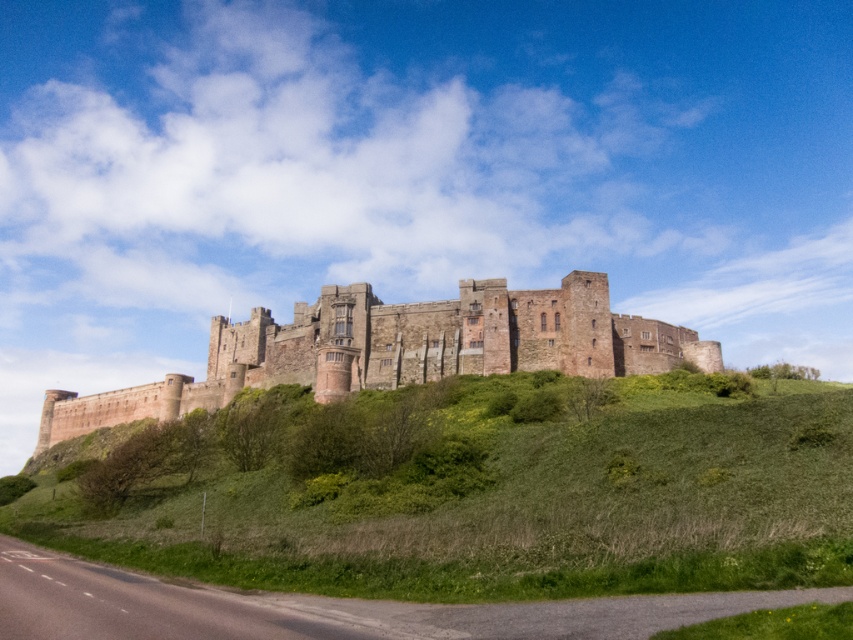
Which is below, green grassy hillside at center or brown stone castle at center?

green grassy hillside at center

Is green grassy hillside at center to the left of brown stone castle at center from the viewer's perspective?

Incorrect, green grassy hillside at center is not on the left side of brown stone castle at center.

The height and width of the screenshot is (640, 853). In order to click on green grassy hillside at center in this screenshot , I will do `click(486, 492)`.

This screenshot has width=853, height=640. Find the location of `green grassy hillside at center`. green grassy hillside at center is located at coordinates (486, 492).